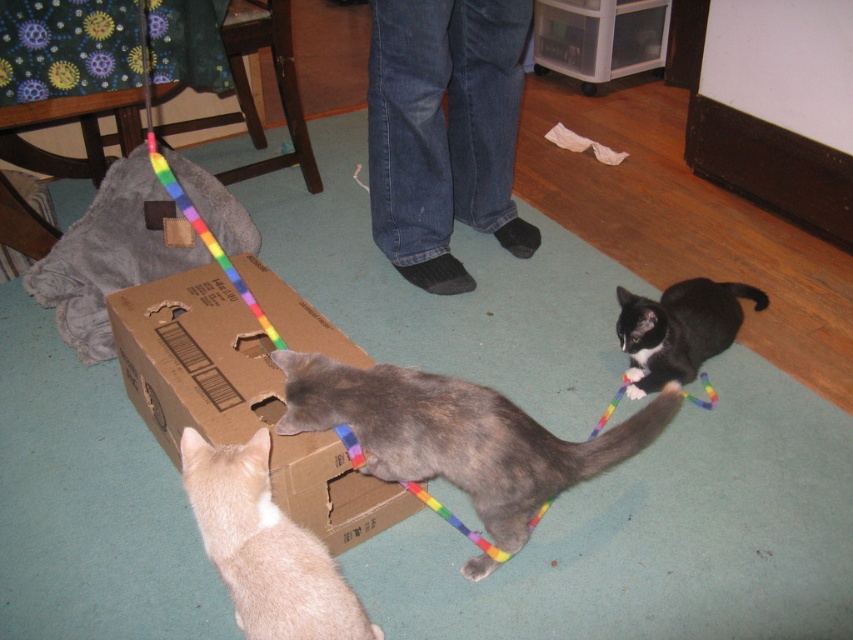
Question: Can you confirm if gray fur cat at center is positioned below black glossy cat at lower right?

Choices:
 (A) no
 (B) yes

Answer: (B)

Question: Does gray fur cat at center appear on the left side of black glossy cat at lower right?

Choices:
 (A) no
 (B) yes

Answer: (B)

Question: Can you confirm if soft gray blanket at upper left is smaller than light orange fur at lower left?

Choices:
 (A) no
 (B) yes

Answer: (A)

Question: Which object is the closest to the brown cardboard box at center?

Choices:
 (A) black glossy cat at lower right
 (B) soft gray blanket at upper left
 (C) gray fur cat at center
 (D) light orange fur at lower left

Answer: (C)

Question: Which of these objects is positioned farthest from the brown cardboard box at center?

Choices:
 (A) black glossy cat at lower right
 (B) light orange fur at lower left

Answer: (A)

Question: Which point is closer to the camera?

Choices:
 (A) black glossy cat at lower right
 (B) brown cardboard box at center
 (C) light orange fur at lower left

Answer: (C)